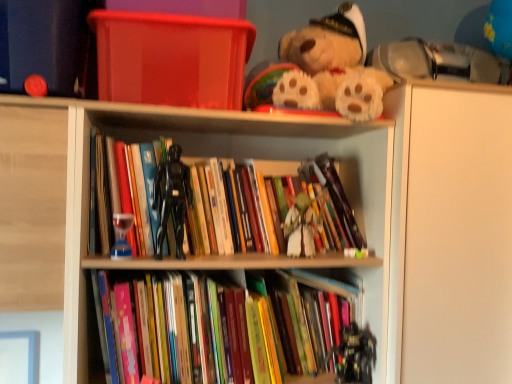
Question: From their relative heights in the image, would you say translucent glass hourglass at center, acting as the second toy starting from the back, is taller or shorter than wooden books at center?

Choices:
 (A) short
 (B) tall

Answer: (A)

Question: Is translucent glass hourglass at center, acting as the second toy starting from the back, inside or outside of wooden books at center?

Choices:
 (A) inside
 (B) outside

Answer: (A)

Question: Considering the real-world distances, which object is farthest from the hardcover books at center, which is the first book in bottom-to-top order?

Choices:
 (A) white matte figurine at center, acting as the 2th miniature starting from the left
 (B) black matte figure at center, which is the 1th miniature from left to right
 (C) translucent glass hourglass at center, acting as the first toy starting from the left
 (D) fluffy beige teddy bear at upper center
 (E) transparent plastic container at upper center

Answer: (D)

Question: Which is farther from the white matte figurine at center, acting as the 2th miniature starting from the left?

Choices:
 (A) fluffy beige teddy bear at upper center
 (B) hardcover books at center, which is the first book in bottom-to-top order
 (C) translucent glass hourglass at center, which is the 2th toy from bottom to top
 (D) white matte cabinet at upper right
 (E) transparent plastic container at upper center

Answer: (E)